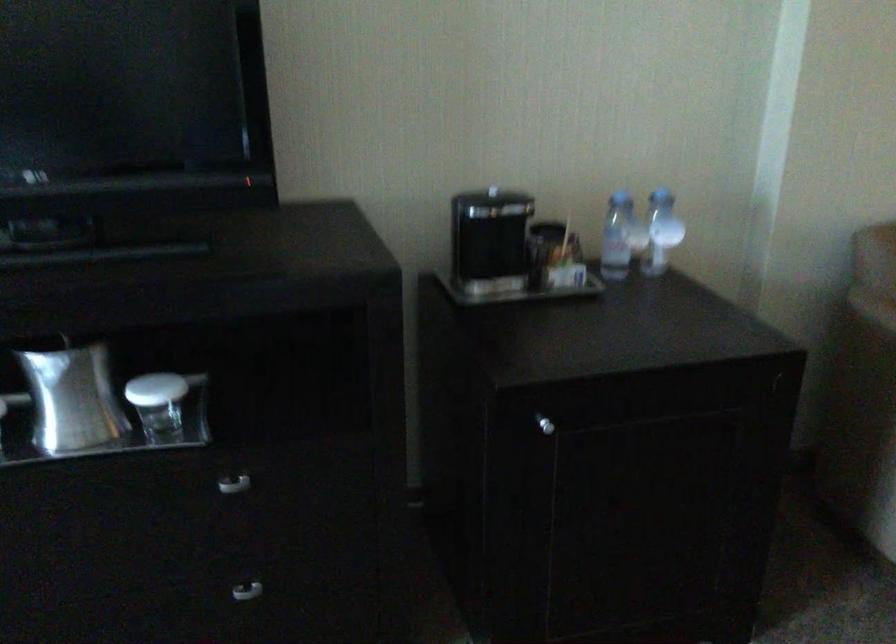
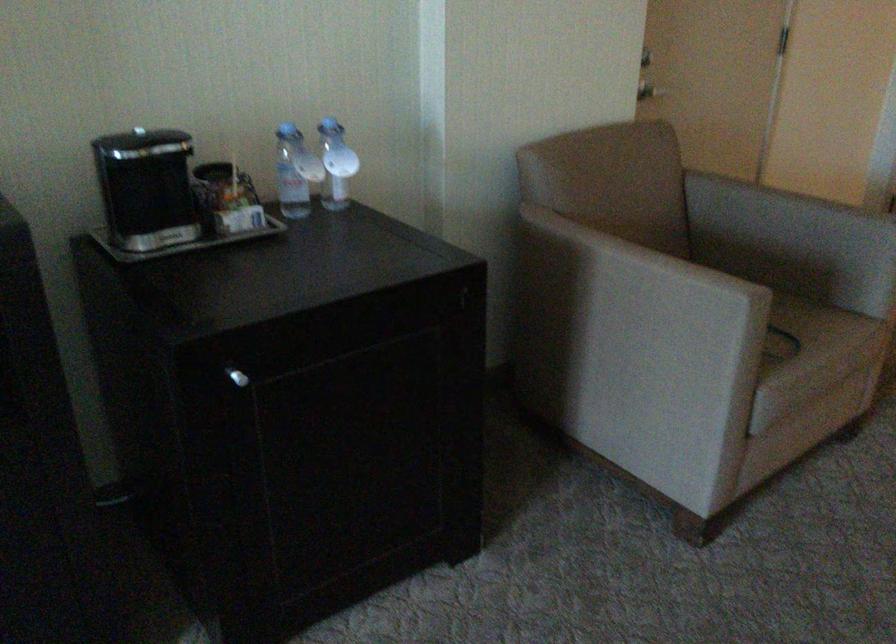
Find the pixel in the second image that matches pixel 487 243 in the first image.

(149, 194)